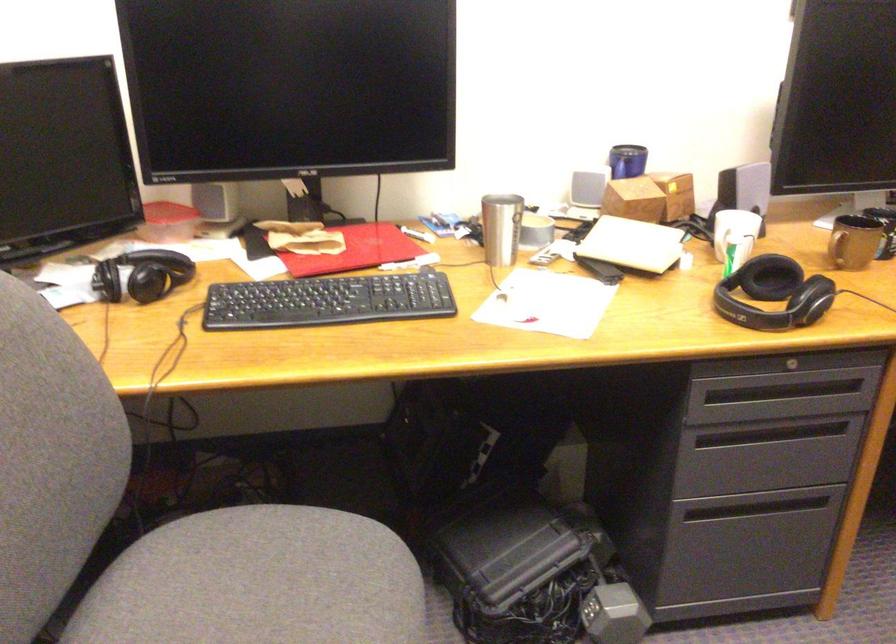
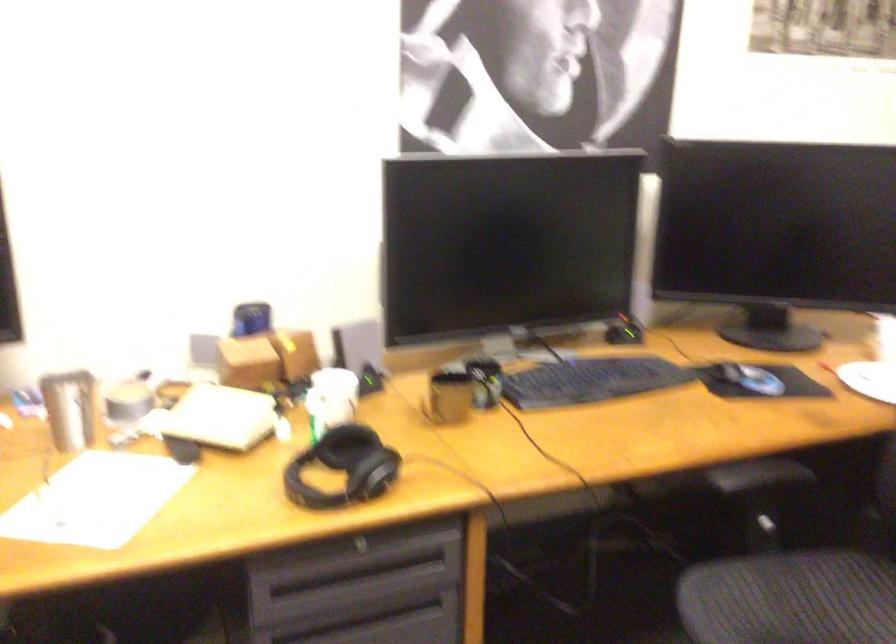
Question: In a continuous first-person perspective shot, in which direction is the camera moving?

Choices:
 (A) Left
 (B) Right
 (C) Forward
 (D) Backward

Answer: (B)